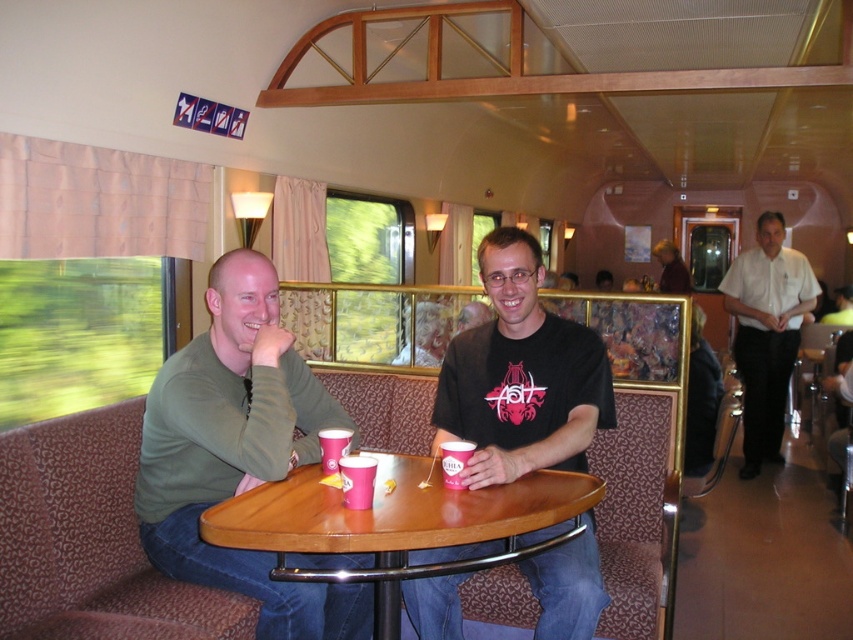
Question: Which object is the closest to the matte green shirt at center?

Choices:
 (A) green matte shirt at left
 (B) black matte t-shirt at center

Answer: (B)

Question: Which object is the closest to the green matte shirt at left?

Choices:
 (A) white shirt at right
 (B) matte green shirt at center
 (C) brown leather jacket at center
 (D) pink paper cup at table center

Answer: (B)

Question: Can you confirm if black matte t-shirt at center is bigger than brown leather jacket at center?

Choices:
 (A) yes
 (B) no

Answer: (A)

Question: Is black matte t-shirt at center further to camera compared to pink paper cup at table center?

Choices:
 (A) no
 (B) yes

Answer: (A)

Question: Is the position of black matte t-shirt at center more distant than that of white shirt at right?

Choices:
 (A) yes
 (B) no

Answer: (B)

Question: Which object is the farthest from the brown leather jacket at center?

Choices:
 (A) black matte t-shirt at center
 (B) white shirt at right
 (C) wooden table at center

Answer: (C)